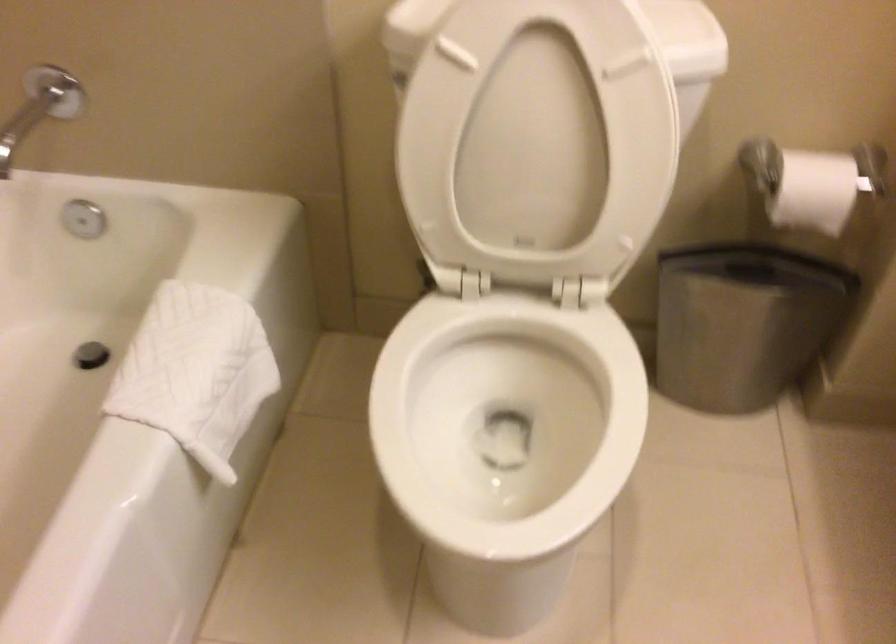
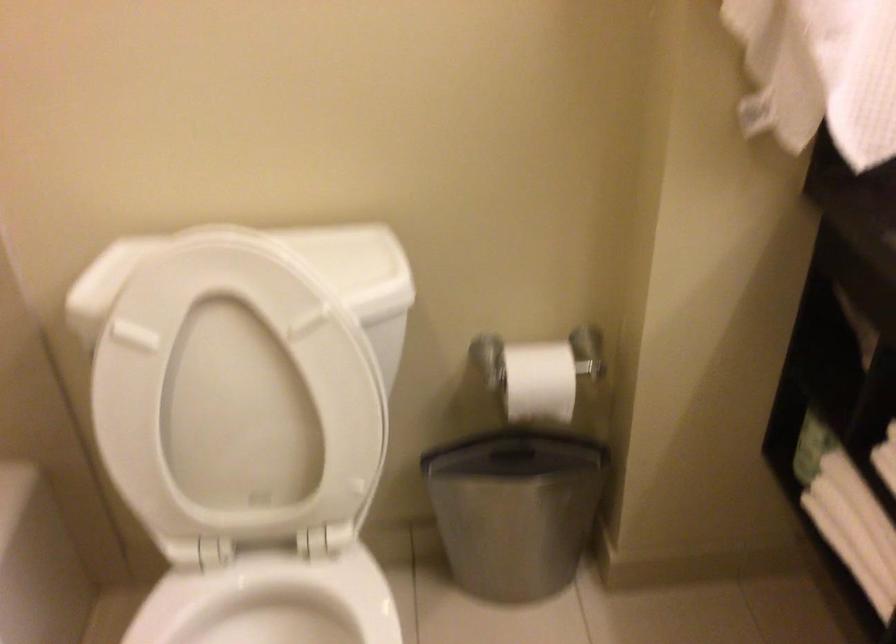
Question: The camera is either moving clockwise (left) or counter-clockwise (right) around the object. The first image is from the beginning of the video and the second image is from the end. Is the camera moving left or right when shooting the video?

Choices:
 (A) Left
 (B) Right

Answer: (A)